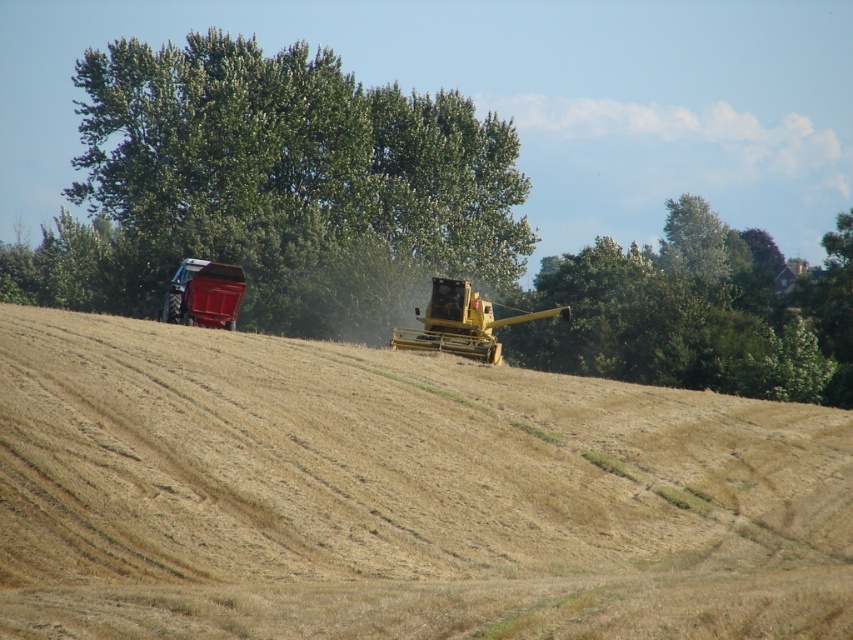
Which is more to the left, green leafy tree at upper center or metallic red tractor at left?

Positioned to the left is metallic red tractor at left.

Is point (469, 188) more distant than point (166, 317)?

That is True.

At what (x,y) coordinates should I click in order to perform the action: click on green leafy tree at upper center. Please return your answer as a coordinate pair (x, y). The width and height of the screenshot is (853, 640). Looking at the image, I should click on (292, 179).

Is green leafy tree at center shorter than metallic red tractor at left?

Incorrect, green leafy tree at center's height does not fall short of metallic red tractor at left's.

In the scene shown: Is green leafy tree at center above metallic red tractor at left?

Indeed, green leafy tree at center is positioned over metallic red tractor at left.

What do you see at coordinates (697, 312) in the screenshot? The height and width of the screenshot is (640, 853). I see `green leafy tree at center` at bounding box center [697, 312].

Find the location of a particular element. green leafy tree at center is located at coordinates (697, 312).

Can you confirm if yellow metallic combine at center is taller than metallic red tractor at left?

Incorrect, yellow metallic combine at center's height is not larger of metallic red tractor at left's.

Is point (473, 337) farther from viewer compared to point (189, 268)?

Yes.

Does point (415, 337) come closer to viewer compared to point (169, 301)?

No, (415, 337) is behind (169, 301).

Where is `yellow metallic combine at center`? yellow metallic combine at center is located at coordinates (461, 323).